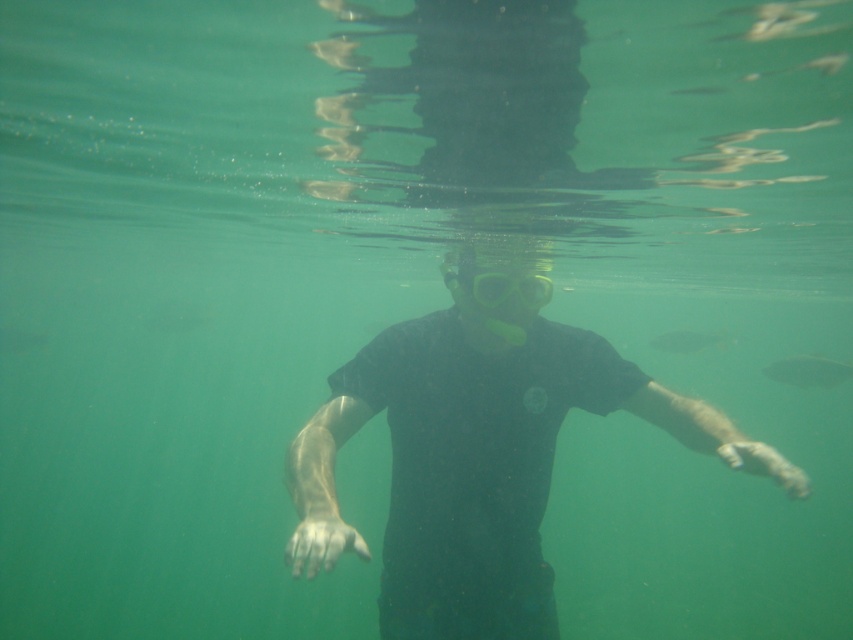
Describe the element at coordinates (479, 458) in the screenshot. I see `black matte t-shirt at center` at that location.

Can you confirm if black matte t-shirt at center is thinner than translucent greenish fish at center?

No, black matte t-shirt at center is not thinner than translucent greenish fish at center.

Is point (549, 358) farther from camera compared to point (804, 380)?

No.

The height and width of the screenshot is (640, 853). Find the location of `black matte t-shirt at center`. black matte t-shirt at center is located at coordinates (479, 458).

Does point (537, 278) come farther from viewer compared to point (799, 369)?

No.

Who is positioned more to the right, clear plastic goggles at center or translucent greenish fish at center?

translucent greenish fish at center

This screenshot has height=640, width=853. I want to click on clear plastic goggles at center, so click(x=509, y=289).

Where is `clear plastic goggles at center`? clear plastic goggles at center is located at coordinates (509, 289).

Which is in front, point (554, 401) or point (682, 336)?

Point (554, 401) is in front.

Is black matte t-shirt at center positioned before green matte fish at center?

That is True.

Describe the element at coordinates (479, 458) in the screenshot. Image resolution: width=853 pixels, height=640 pixels. I see `black matte t-shirt at center` at that location.

Where is `black matte t-shirt at center`? The width and height of the screenshot is (853, 640). black matte t-shirt at center is located at coordinates (479, 458).